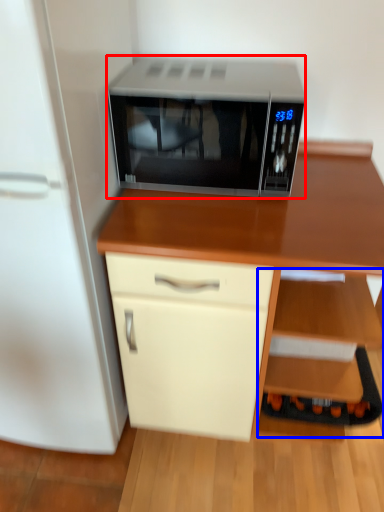
Question: Which of the following is the farthest to the observer, microwave oven (highlighted by a red box) or shelf (highlighted by a blue box)?

Choices:
 (A) microwave oven
 (B) shelf

Answer: (B)